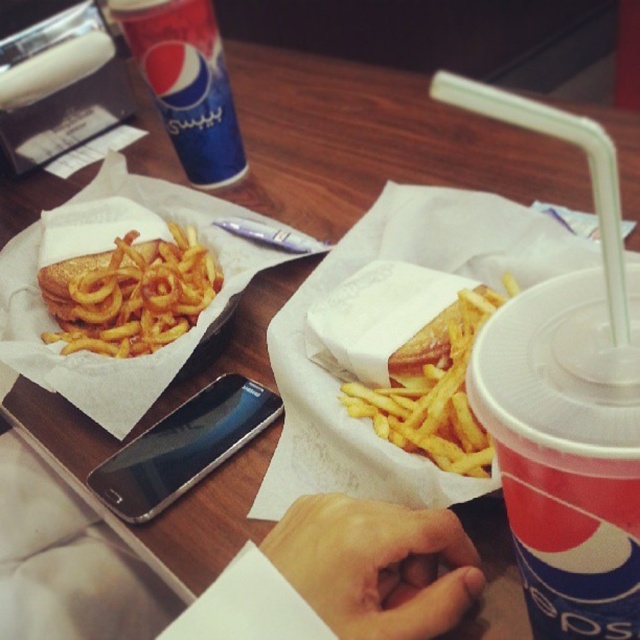
Question: Which of these objects is positioned closest to the blue paper cup at upper left?

Choices:
 (A) translucent plastic cup with straw at center right
 (B) black glossy smartphone at center

Answer: (B)

Question: Among these objects, which one is farthest from the camera?

Choices:
 (A) black glossy smartphone at center
 (B) golden crispy french fries at left

Answer: (B)

Question: Is golden crispy french fries at left bigger than blue paper cup at upper left?

Choices:
 (A) no
 (B) yes

Answer: (A)

Question: Can you confirm if golden crispy french fries at center is positioned to the right of blue paper cup at upper left?

Choices:
 (A) yes
 (B) no

Answer: (A)

Question: Is translucent plastic cup with straw at center right to the left of blue paper cup at upper left from the viewer's perspective?

Choices:
 (A) yes
 (B) no

Answer: (B)

Question: Among these objects, which one is nearest to the camera?

Choices:
 (A) black glossy smartphone at center
 (B) golden crispy french fries at center

Answer: (B)